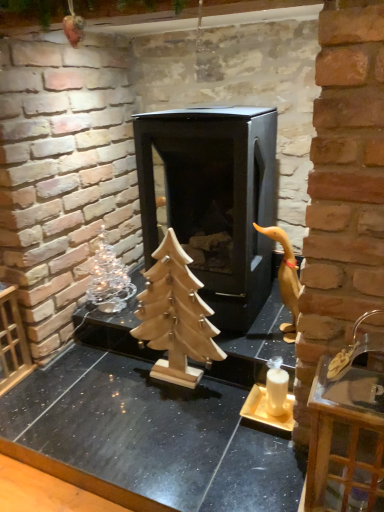
You are a GUI agent. You are given a task and a screenshot of the screen. Output one action in this format:
    pyautogui.click(x=<x>, y=<y>)
    Task: Click on the vacant region above wooden tree at center (from a real-world perspective)
    The width and height of the screenshot is (384, 512).
    Given the screenshot: What is the action you would take?
    pyautogui.click(x=132, y=417)